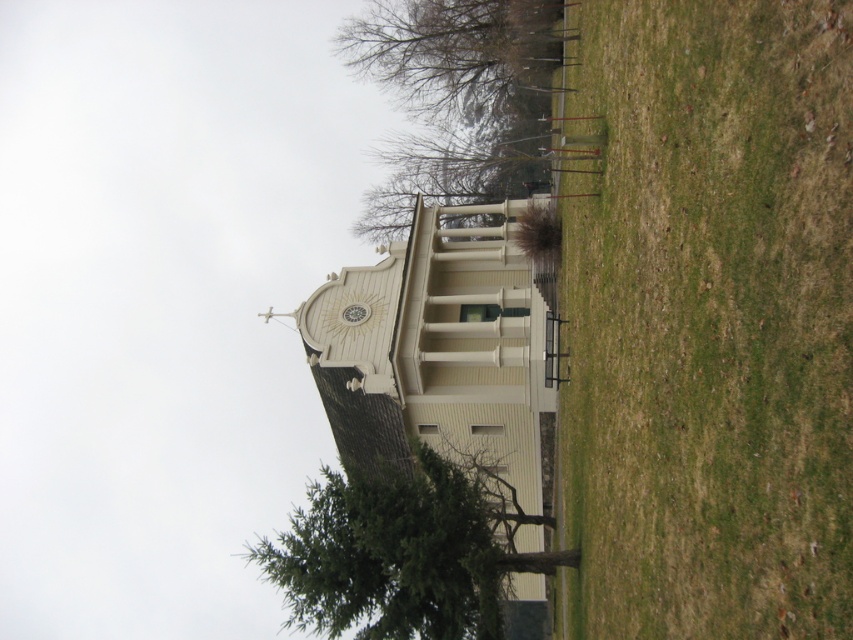
Question: Does green grass at lower right appear over green leafy tree at lower center?

Choices:
 (A) no
 (B) yes

Answer: (B)

Question: Which object is positioned farthest from the green leafy tree at center?

Choices:
 (A) green leafy tree at lower center
 (B) green grass at lower right

Answer: (B)

Question: Can you confirm if green leafy tree at lower center is smaller than green leafy tree at center?

Choices:
 (A) yes
 (B) no

Answer: (A)

Question: Which of the following is the closest to the observer?

Choices:
 (A) (717, 497)
 (B) (509, 13)

Answer: (A)

Question: Is green leafy tree at lower center to the left of green leafy tree at center from the viewer's perspective?

Choices:
 (A) no
 (B) yes

Answer: (B)

Question: Estimate the real-world distances between objects in this image. Which object is farther from the green leafy tree at center?

Choices:
 (A) green grass at lower right
 (B) green leafy tree at lower center

Answer: (A)